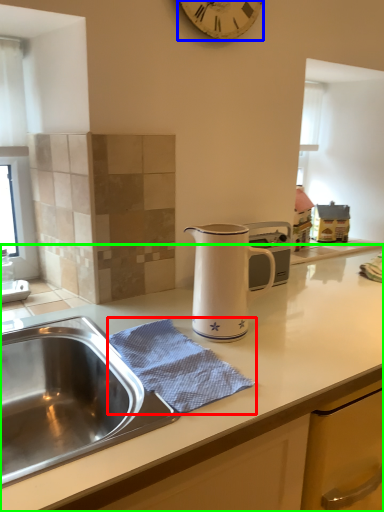
Question: Considering the real-world distances, which object is closest to blanket (highlighted by a red box)? clock (highlighted by a blue box) or countertop (highlighted by a green box).

Choices:
 (A) clock
 (B) countertop

Answer: (B)